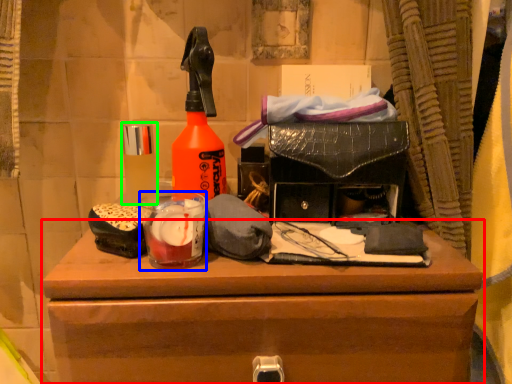
Question: Which is farther away from chest of drawers (highlighted by a red box)? beverage (highlighted by a blue box) or toiletry (highlighted by a green box)?

Choices:
 (A) beverage
 (B) toiletry

Answer: (B)